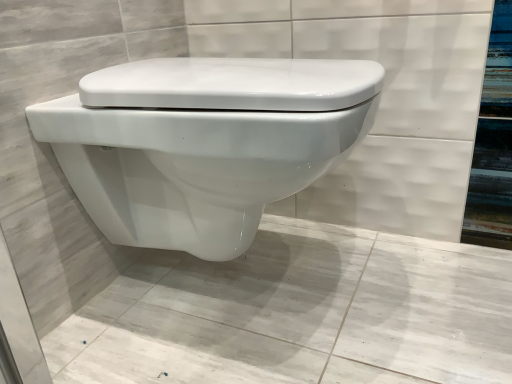
What do you see at coordinates (298, 314) in the screenshot?
I see `white glossy toilet at center` at bounding box center [298, 314].

The image size is (512, 384). What are the coordinates of `white glossy toilet at center` in the screenshot? It's located at (298, 314).

The height and width of the screenshot is (384, 512). What do you see at coordinates (204, 143) in the screenshot?
I see `white glossy toilet at center` at bounding box center [204, 143].

You are a GUI agent. You are given a task and a screenshot of the screen. Output one action in this format:
    pyautogui.click(x=<x>, y=<y>)
    Task: Click on the white glossy toilet at center
    
    Given the screenshot: What is the action you would take?
    pyautogui.click(x=204, y=143)

This screenshot has width=512, height=384. I want to click on white glossy toilet at center, so click(298, 314).

Is white glossy toilet at center to the right of white glossy toilet at center from the viewer's perspective?

Yes, white glossy toilet at center is to the right of white glossy toilet at center.

In the image, is white glossy toilet at center positioned in front of or behind white glossy toilet at center?

white glossy toilet at center is positioned farther from the viewer than white glossy toilet at center.

Between point (128, 64) and point (84, 314), which one is positioned in front?

The point (128, 64) is more forward.

From the image's perspective, does white glossy toilet at center appear higher than white glossy toilet at center?

Yes.

From a real-world perspective, which object rests below the other?

In real-world perspective, white glossy toilet at center is lower.

Can you confirm if white glossy toilet at center is thinner than white glossy toilet at center?

Yes, white glossy toilet at center is thinner than white glossy toilet at center.

Between white glossy toilet at center and white glossy toilet at center, which one has less height?

white glossy toilet at center is shorter.

Does white glossy toilet at center have a larger size compared to white glossy toilet at center?

Yes, white glossy toilet at center is bigger than white glossy toilet at center.

From the picture: Could white glossy toilet at center be considered to be inside white glossy toilet at center?

No, white glossy toilet at center is not a part of white glossy toilet at center.

Is white glossy toilet at center next to white glossy toilet at center?

There is a gap between white glossy toilet at center and white glossy toilet at center.

Does white glossy toilet at center turn towards white glossy toilet at center?

No, white glossy toilet at center is not aimed at white glossy toilet at center.

Measure the distance between white glossy toilet at center and white glossy toilet at center.

white glossy toilet at center and white glossy toilet at center are 30.49 centimeters apart from each other.

The image size is (512, 384). In order to click on toilet that appears above the white glossy toilet at center (from a real-world perspective) in this screenshot , I will do `click(204, 143)`.

Considering the relative positions of white glossy toilet at center and white glossy toilet at center in the image provided, is white glossy toilet at center to the left or to the right of white glossy toilet at center?

white glossy toilet at center is positioned on white glossy toilet at center's left side.

Who is more distant, white glossy toilet at center or white glossy toilet at center?

white glossy toilet at center is more distant.

Is point (249, 274) closer to camera compared to point (342, 87)?

No.

From the image's perspective, relative to white glossy toilet at center, is white glossy toilet at center above or below?

white glossy toilet at center is situated lower than white glossy toilet at center in the image.

From a real-world perspective, is white glossy toilet at center positioned under white glossy toilet at center based on gravity?

Yes, from a real-world perspective, white glossy toilet at center is under white glossy toilet at center.

Which object is thinner, white glossy toilet at center or white glossy toilet at center?

With smaller width is white glossy toilet at center.

Does white glossy toilet at center have a lesser height compared to white glossy toilet at center?

Yes, white glossy toilet at center is shorter than white glossy toilet at center.

Can you confirm if white glossy toilet at center is bigger than white glossy toilet at center?

Actually, white glossy toilet at center might be smaller than white glossy toilet at center.

Is white glossy toilet at center spatially inside white glossy toilet at center, or outside of it?

white glossy toilet at center is not inside white glossy toilet at center, it's outside.

Does white glossy toilet at center touch white glossy toilet at center?

They are not placed beside each other.

From the picture: Could you tell me if white glossy toilet at center is turned towards white glossy toilet at center?

No, white glossy toilet at center is not facing towards white glossy toilet at center.

Consider the image. Can you tell me how much white glossy toilet at center and white glossy toilet at center differ in facing direction?

The angular difference between white glossy toilet at center and white glossy toilet at center is 89.5 degrees.

How much distance is there between white glossy toilet at center and white glossy toilet at center?

white glossy toilet at center is 12.00 inches from white glossy toilet at center.

Identify the location of toilet above the white glossy toilet at center (from the image's perspective). (204, 143).

The height and width of the screenshot is (384, 512). Identify the location of toilet behind the white glossy toilet at center. (204, 143).

Find the location of a particular element. The height and width of the screenshot is (384, 512). concrete on the left of white glossy toilet at center is located at coordinates (298, 314).